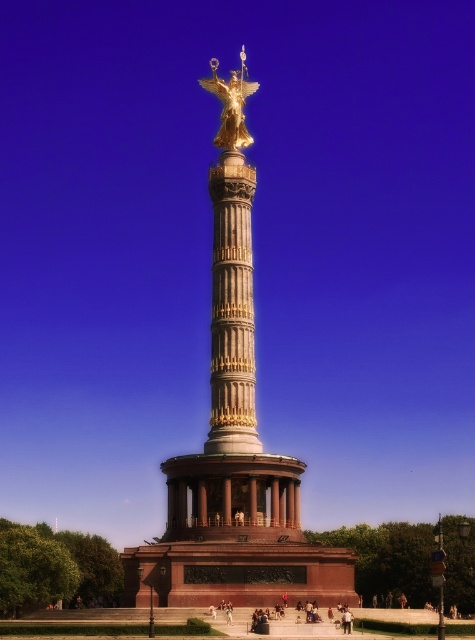
Question: Can you confirm if gold polished column at center is positioned above golden statue at center?

Choices:
 (A) no
 (B) yes

Answer: (B)

Question: Which object is positioned farthest from the gold/gilded column at center?

Choices:
 (A) gold metallic statue at upper center
 (B) golden statue at center
 (C) gold polished column at center

Answer: (B)

Question: Which object is closer to the camera taking this photo?

Choices:
 (A) gold/gilded column at center
 (B) light brown wooden bench at center
 (C) gold polished column at center
 (D) golden statue at center

Answer: (D)

Question: Based on their relative distances, which object is farther from the gold/gilded column at center?

Choices:
 (A) light brown wooden bench at center
 (B) gold metallic statue at upper center
 (C) golden statue at center

Answer: (A)

Question: Can you confirm if gold metallic statue at upper center is positioned above light brown wooden bench at center?

Choices:
 (A) no
 (B) yes

Answer: (B)

Question: Is gold polished column at center above golden statue at center?

Choices:
 (A) yes
 (B) no

Answer: (A)